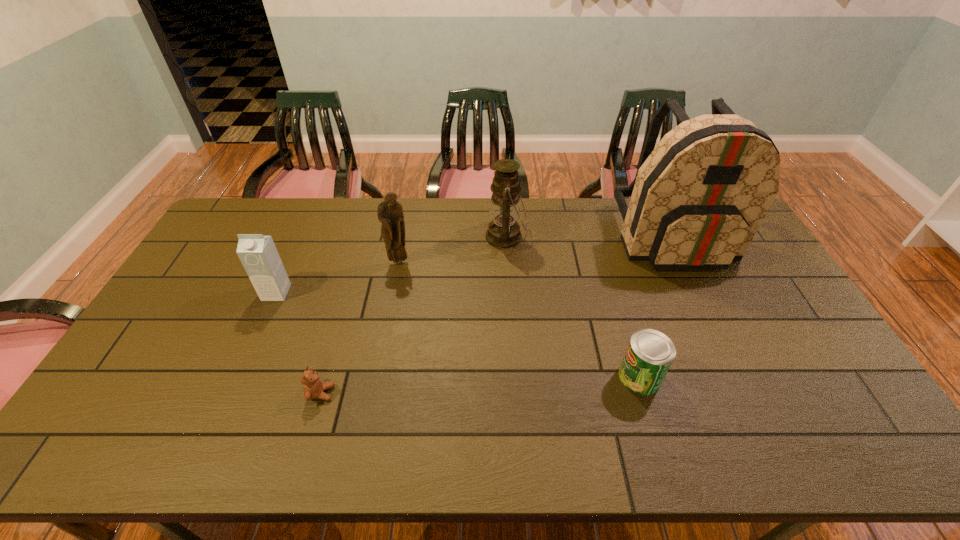
This screenshot has width=960, height=540. Find the location of `backpack`. backpack is located at coordinates (697, 200).

Identify the location of the tallest object. coord(697,200).

The width and height of the screenshot is (960, 540). Identify the location of oil lamp. (503, 232).

Identify the location of the fourth object from right to left. (390, 212).

Find the location of `carton`. carton is located at coordinates (258, 254).

Find the location of a particular element. This screenshot has height=540, width=960. the third shortest object is located at coordinates (258, 254).

Locate an element on the screen. the second shortest object is located at coordinates (650, 353).

The width and height of the screenshot is (960, 540). Identify the location of can. (650, 353).

You are a GUI agent. You are given a task and a screenshot of the screen. Output one action in this format:
    pyautogui.click(x=<x>, y=<y>)
    Task: Click on the shortest object
    Image resolution: width=960 pixels, height=540 pixels.
    Given the screenshot: What is the action you would take?
    pyautogui.click(x=313, y=387)

Find the location of a particular element. the fifth object from right to left is located at coordinates (313, 387).